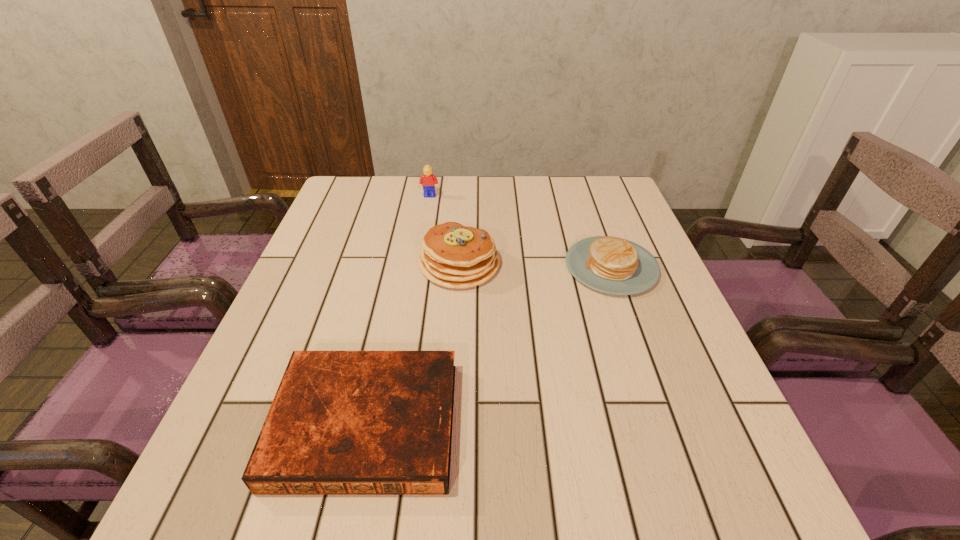
You are a GUI agent. You are given a task and a screenshot of the screen. Output one action in this format:
    pyautogui.click(x=<x>, y=<y>)
    Task: Click on the object present at the left edge
    Image resolution: width=960 pixels, height=540 pixels.
    Given the screenshot: What is the action you would take?
    pyautogui.click(x=342, y=422)

At what (x,y) coordinates should I click in order to perform the action: click on object present at the right edge. Please return your answer as a coordinate pair (x, y). Looking at the image, I should click on (612, 265).

The image size is (960, 540). I want to click on object situated at the near left corner, so click(342, 422).

In the image, there is a desktop. Identify the location of vacant space at the far edge. (418, 195).

I want to click on vacant space at the near edge of the desktop, so click(x=332, y=502).

In the image, there is a desktop. Find the location of `vacant space at the left edge`. vacant space at the left edge is located at coordinates (306, 315).

Find the location of a particular element. vacant space at the right edge of the desktop is located at coordinates (623, 302).

Find the location of a particular element. This screenshot has height=540, width=960. vacant space at the far left corner of the desktop is located at coordinates (374, 182).

In the image, there is a desktop. At what (x,y) coordinates should I click in order to perform the action: click on vacant space at the far right corner. Please return your answer as a coordinate pair (x, y). Looking at the image, I should click on (614, 180).

At what (x,y) coordinates should I click in order to perform the action: click on vacant point at the near right corner. Please return your answer as a coordinate pair (x, y). Looking at the image, I should click on (747, 521).